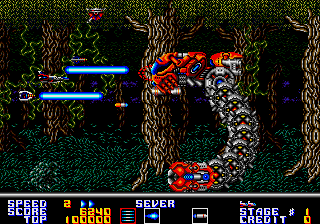
You are a GUI agent. You are given a task and a screenshot of the screen. Output one action in this format:
    pyautogui.click(x=<x>, y=<y>)
    Task: Click on the stage
    Image resolution: width=320 pixels, height=224 pixels.
    Given the screenshot: What is the action you would take?
    pyautogui.click(x=259, y=206)